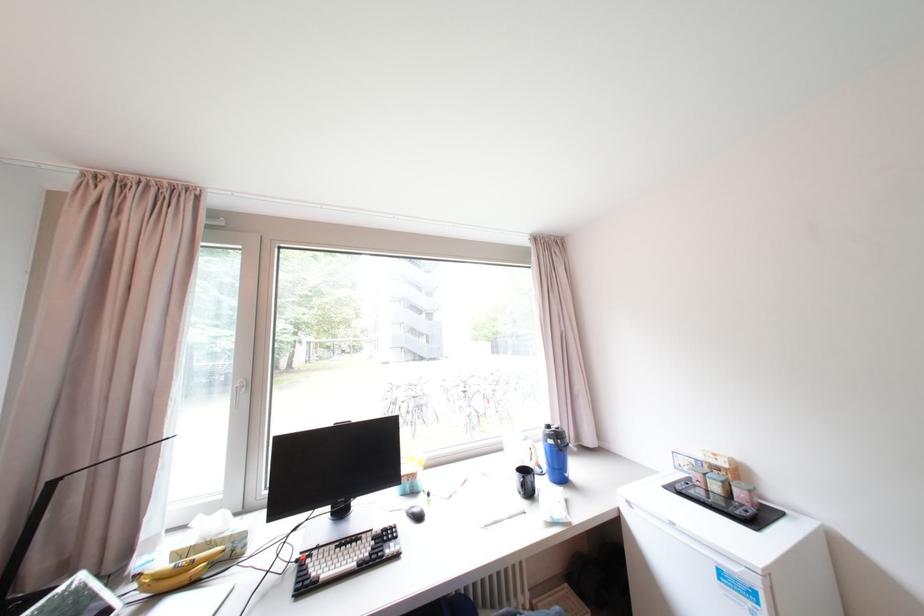
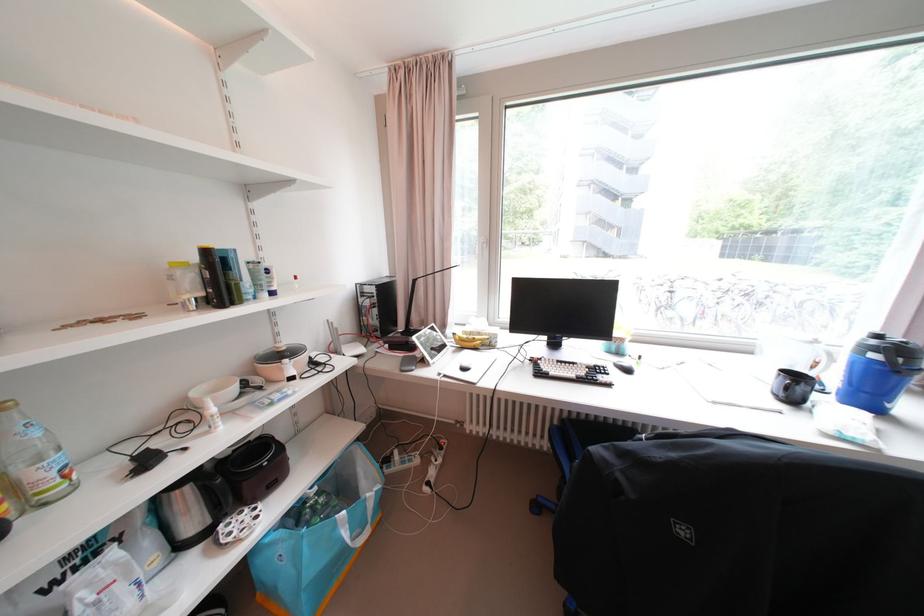
Find the pixel in the second image that matches point 165,580 in the first image.

(468, 341)